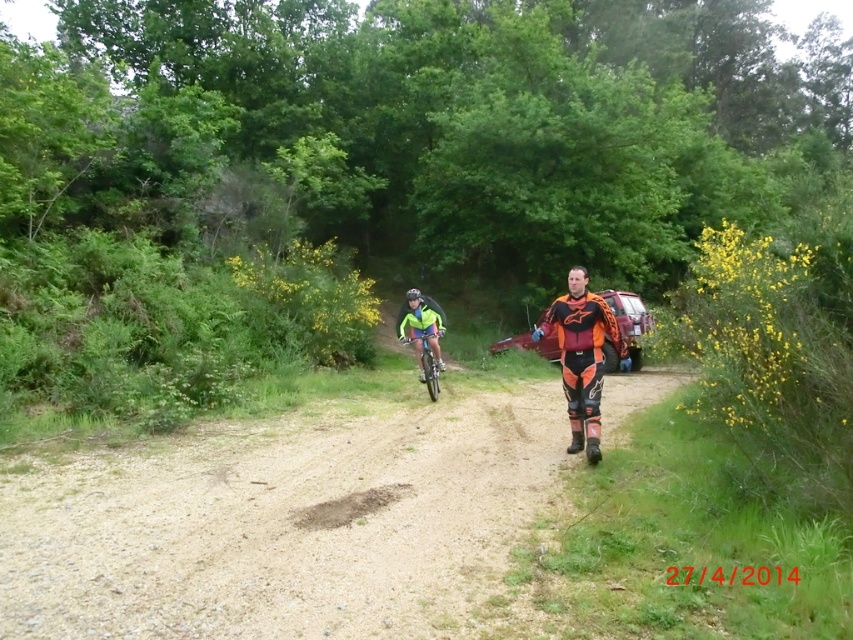
Question: Which object is positioned closest to the neon green fabric at center?

Choices:
 (A) green matte bicycle at center
 (B) dirt path at center
 (C) orange/black motocross suit at center

Answer: (A)

Question: Is neon green fabric at center to the right of green matte bicycle at center from the viewer's perspective?

Choices:
 (A) yes
 (B) no

Answer: (B)

Question: Which object appears closest to the camera in this image?

Choices:
 (A) neon green fabric at center
 (B) dirt path at center
 (C) green matte bicycle at center
 (D) orange/black motocross suit at center

Answer: (B)

Question: Is dirt path at center to the left of orange/black motocross suit at center from the viewer's perspective?

Choices:
 (A) no
 (B) yes

Answer: (B)

Question: In this image, where is dirt path at center located relative to green matte bicycle at center?

Choices:
 (A) above
 (B) below

Answer: (B)

Question: Which object appears farthest from the camera in this image?

Choices:
 (A) orange/black motocross suit at center
 (B) dirt path at center

Answer: (A)